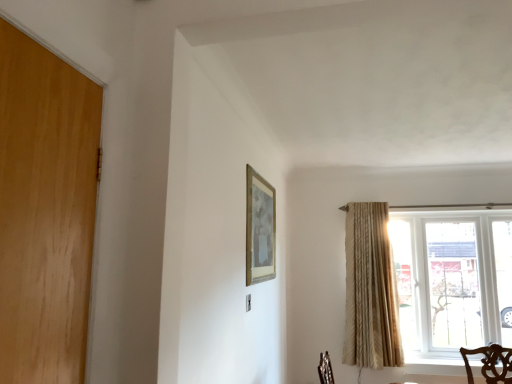
What do you see at coordinates (453, 279) in the screenshot? Image resolution: width=512 pixels, height=384 pixels. I see `clear glass window at right` at bounding box center [453, 279].

Describe the element at coordinates (260, 228) in the screenshot. I see `gold metallic picture frame at upper center` at that location.

You are a GUI agent. You are given a task and a screenshot of the screen. Output one action in this format:
    pyautogui.click(x=<x>, y=<y>)
    Task: Click on the gold metallic picture frame at upper center
    The width and height of the screenshot is (512, 384).
    Given the screenshot: What is the action you would take?
    pyautogui.click(x=260, y=228)

At what (x,y) coordinates should I click in order to perform the action: click on beige textured curtain at right. Please return your answer as a coordinate pair (x, y). The image size is (512, 384). Looking at the image, I should click on (370, 290).

In order to click on clear glass window at right in this screenshot , I will do `click(453, 279)`.

Between clear glass window at right and beige textured curtain at right, which one has less height?

clear glass window at right is shorter.

Which is behind, point (402, 249) or point (379, 350)?

The point (402, 249) is farther.

Is clear glass window at right with beige textured curtain at right?

No, clear glass window at right is not touching beige textured curtain at right.

Which of these two, clear glass window at right or beige textured curtain at right, is thinner?

Thinner between the two is beige textured curtain at right.

Image resolution: width=512 pixels, height=384 pixels. In the image, there is a clear glass window at right. What are the coordinates of `picture frame above it (from the image's perspective)` in the screenshot? It's located at (260, 228).

Can you confirm if gold metallic picture frame at upper center is bigger than clear glass window at right?

No, gold metallic picture frame at upper center is not bigger than clear glass window at right.

In the image, is gold metallic picture frame at upper center positioned in front of or behind clear glass window at right?

gold metallic picture frame at upper center is in front of clear glass window at right.

Is gold metallic picture frame at upper center beside beige textured curtain at right?

There is a gap between gold metallic picture frame at upper center and beige textured curtain at right.

From the image's perspective, is gold metallic picture frame at upper center over beige textured curtain at right?

Yes, from the image's perspective, gold metallic picture frame at upper center is above beige textured curtain at right.

Which object is positioned more to the left, gold metallic picture frame at upper center or beige textured curtain at right?

gold metallic picture frame at upper center.

Who is taller, gold metallic picture frame at upper center or beige textured curtain at right?

Standing taller between the two is beige textured curtain at right.

From a real-world perspective, is beige textured curtain at right above or below clear glass window at right?

From a real-world perspective, beige textured curtain at right is physically above clear glass window at right.

Do you think beige textured curtain at right is within clear glass window at right, or outside of it?

beige textured curtain at right is spatially situated outside clear glass window at right.

Is beige textured curtain at right positioned behind clear glass window at right?

No, it is in front of clear glass window at right.

From the image's perspective, does beige textured curtain at right appear lower than clear glass window at right?

Actually, beige textured curtain at right appears above clear glass window at right in the image.

Which point is more distant from viewer, (355, 351) or (272, 213)?

The point (355, 351) is farther from the camera.

Is gold metallic picture frame at upper center at the back of beige textured curtain at right?

That's not correct — beige textured curtain at right is not looking away from gold metallic picture frame at upper center.

Is gold metallic picture frame at upper center completely or partially inside beige textured curtain at right?

No, gold metallic picture frame at upper center is located outside of beige textured curtain at right.

Could gold metallic picture frame at upper center be considered to be inside clear glass window at right?

No, gold metallic picture frame at upper center is located outside of clear glass window at right.

In the scene shown: How much distance is there between clear glass window at right and gold metallic picture frame at upper center?

clear glass window at right is 6.03 feet from gold metallic picture frame at upper center.

Consider the image. Does clear glass window at right have a lesser width compared to gold metallic picture frame at upper center?

No, clear glass window at right is not thinner than gold metallic picture frame at upper center.

This screenshot has height=384, width=512. What are the coordinates of `window behind the beige textured curtain at right` in the screenshot? It's located at (453, 279).

I want to click on picture frame that is above the clear glass window at right (from the image's perspective), so click(x=260, y=228).

Considering their positions, is beige textured curtain at right positioned closer to gold metallic picture frame at upper center than clear glass window at right?

beige textured curtain at right.

Based on the photo, when comparing their distances from gold metallic picture frame at upper center, does clear glass window at right or beige textured curtain at right seem closer?

Based on the image, beige textured curtain at right appears to be nearer to gold metallic picture frame at upper center.

Based on their spatial positions, is beige textured curtain at right or gold metallic picture frame at upper center further from clear glass window at right?

Based on the image, gold metallic picture frame at upper center appears to be further to clear glass window at right.

Based on their spatial positions, is gold metallic picture frame at upper center or clear glass window at right closer to beige textured curtain at right?

clear glass window at right lies closer to beige textured curtain at right than the other object.

Looking at this image, estimate the real-world distances between objects in this image. Which object is further from clear glass window at right, gold metallic picture frame at upper center or beige textured curtain at right?

Based on the image, gold metallic picture frame at upper center appears to be further to clear glass window at right.

When comparing their distances from beige textured curtain at right, does clear glass window at right or gold metallic picture frame at upper center seem further?

Among the two, gold metallic picture frame at upper center is located further to beige textured curtain at right.

Locate an element on the screen. This screenshot has height=384, width=512. curtain situated between gold metallic picture frame at upper center and clear glass window at right from left to right is located at coordinates (370, 290).